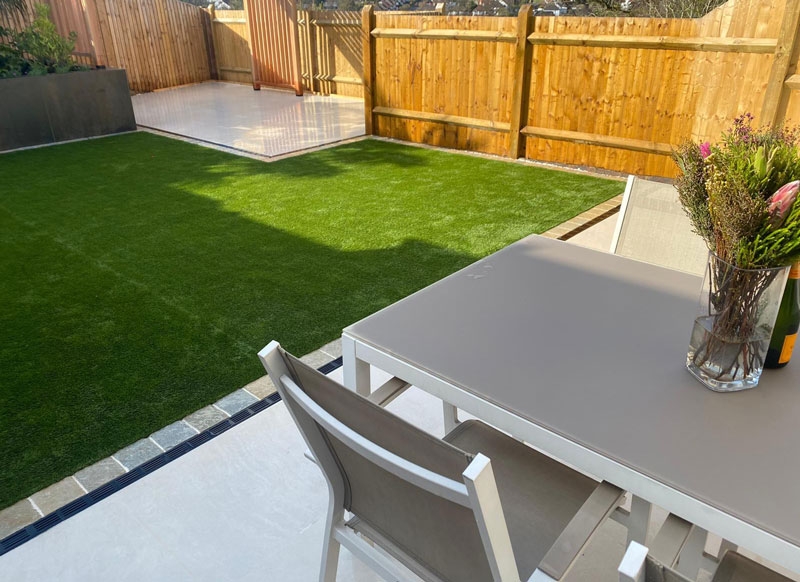
Image resolution: width=800 pixels, height=582 pixels. In order to click on bottle in this screenshot , I will do `click(786, 354)`.